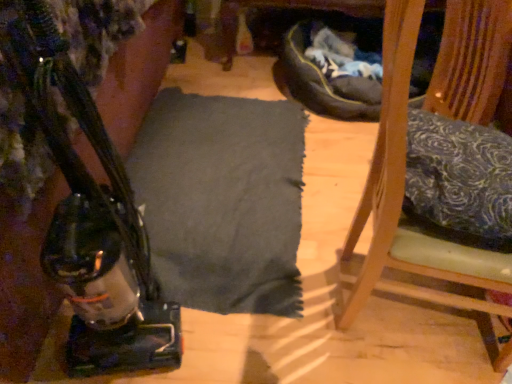
In order to click on vacant space underneath wooden chair at right (from a real-world perspective) in this screenshot , I will do `click(413, 322)`.